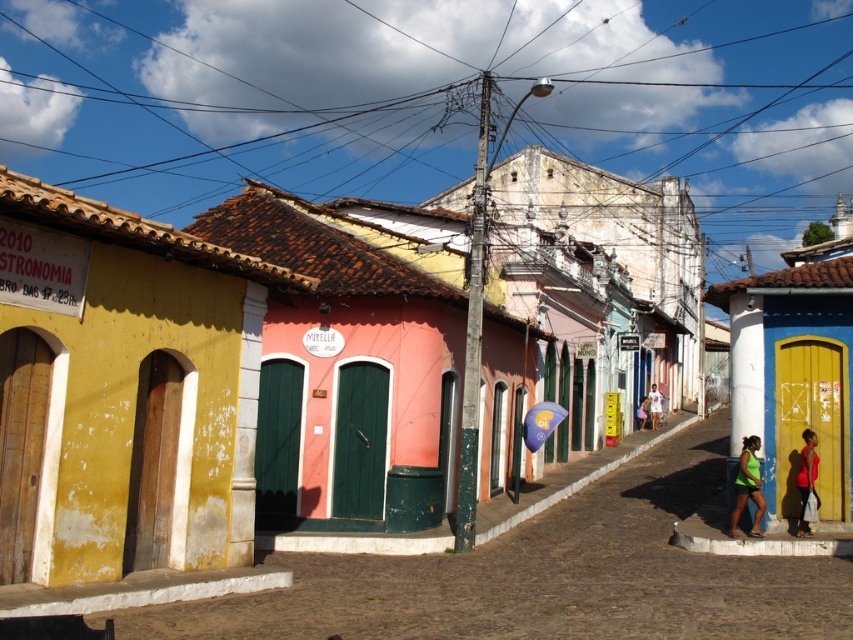
You are a delivery person trying to navigate through the street. You see a brown wire at upper center and a green matte tank top at lower right. Which object is higher up in the image?

The brown wire at upper center is higher up in the image than the green matte tank top at lower right.

You are a tourist walking along the cobblestone street in the historic town. You see a red fabric shirt at lower right and a matte pink shirt at center. Which shirt is positioned to the left of the other?

The red fabric shirt at lower right is positioned to the left of the matte pink shirt at center.

You are a city planner analyzing the layout of this historic town. You notice a brown wire at upper center. Can you determine its exact coordinates in the image?

The brown wire at upper center is located at coordinates point (434, 99).